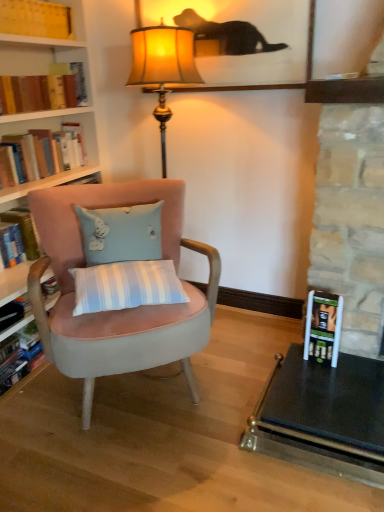
Identify the location of unoccupied region to the right of velvet pink chair at center. (249, 368).